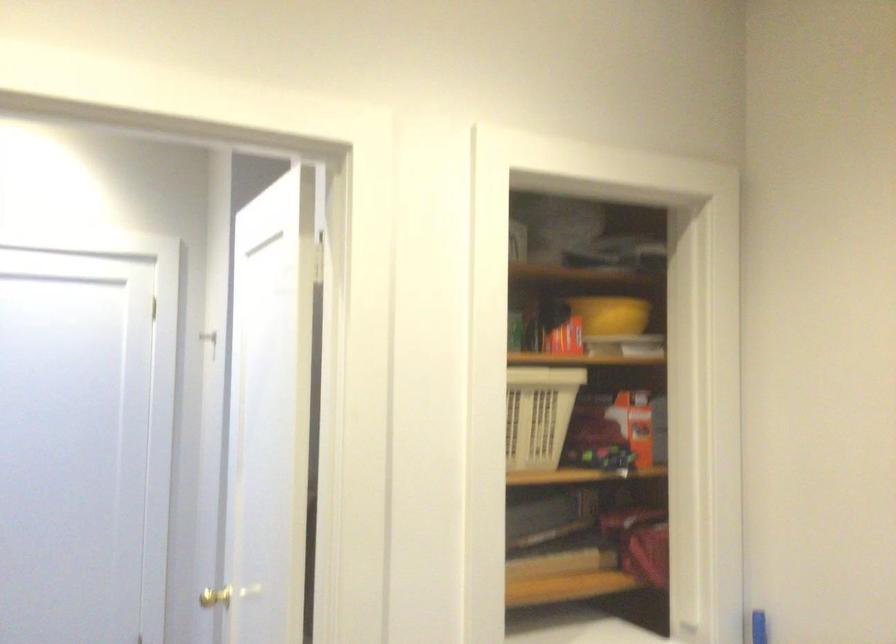
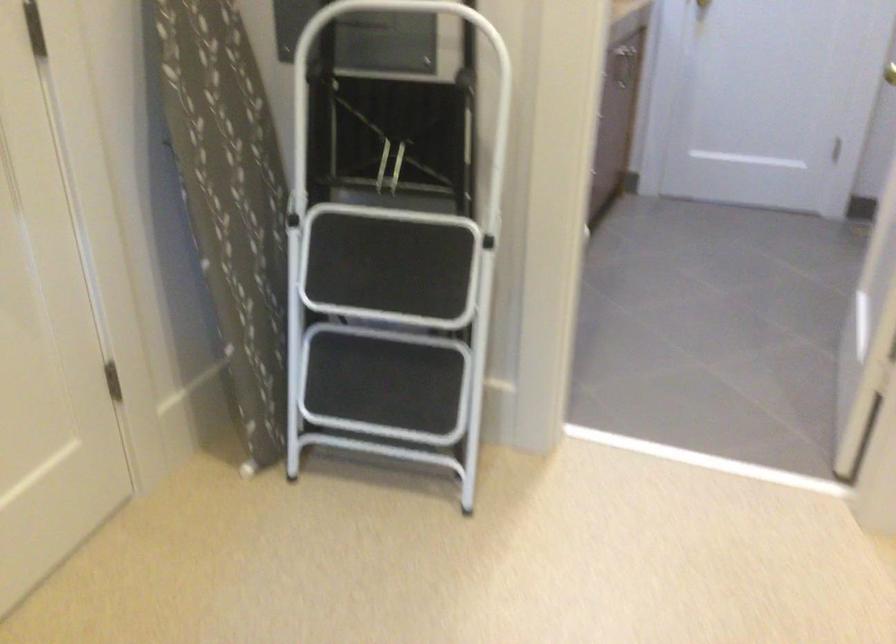
Locate, in the second image, the point that corresponds to the point at 174,565 in the first image.

(890, 73)